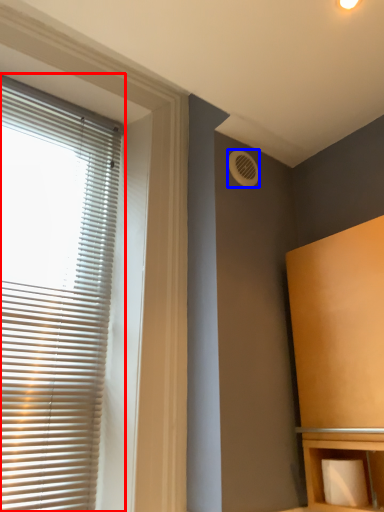
Question: Among these objects, which one is farthest to the camera, window blind (highlighted by a red box) or air conditioning (highlighted by a blue box)?

Choices:
 (A) window blind
 (B) air conditioning

Answer: (B)